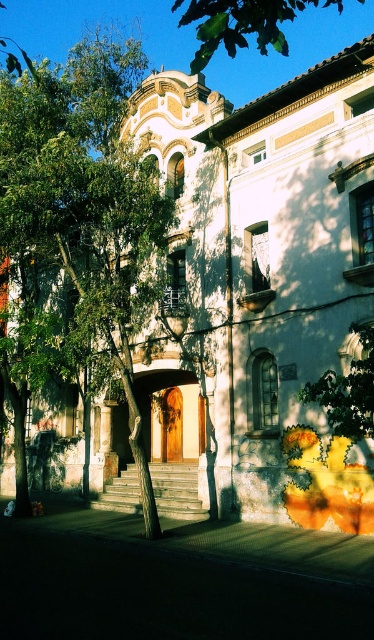
Question: Which object is closer to the camera taking this photo?

Choices:
 (A) green leafy tree at center
 (B) green leafy tree at upper center

Answer: (B)

Question: Among these points, which one is nearest to the camera?

Choices:
 (A) (22, 326)
 (B) (203, 4)

Answer: (B)

Question: Which object appears farthest from the camera in this image?

Choices:
 (A) green leafy tree at upper center
 (B) green leafy tree at center

Answer: (B)

Question: Is green leafy tree at center positioned before green leafy tree at upper center?

Choices:
 (A) no
 (B) yes

Answer: (A)

Question: Is green leafy tree at center thinner than green leafy tree at upper center?

Choices:
 (A) yes
 (B) no

Answer: (A)

Question: Is green leafy tree at center below green leafy tree at upper center?

Choices:
 (A) yes
 (B) no

Answer: (A)